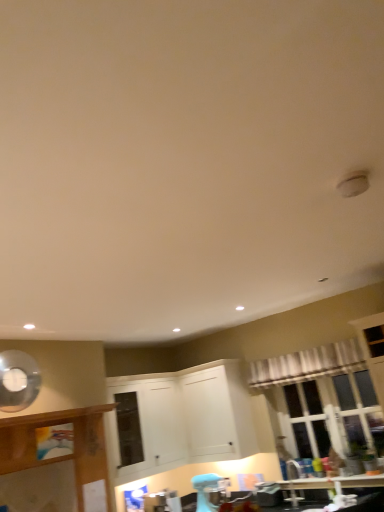
Question: From a real-world perspective, is white matte cabinet at center, arranged as the second cabinetry when viewed from the left, positioned above or below white sheer curtain at upper right?

Choices:
 (A) above
 (B) below

Answer: (B)

Question: Relative to white sheer curtain at upper right, is white matte cabinet at center, arranged as the second cabinetry when viewed from the left, in front or behind?

Choices:
 (A) behind
 (B) front

Answer: (A)

Question: Based on their relative distances, which object is farther from the wooden cabinet at left, the 3th cabinetry when ordered from right to left?

Choices:
 (A) white matte cabinet at center, the 1th cabinetry in the right-to-left sequence
 (B) white sheer curtain at upper right
 (C) white matte cabinet at center, which is the 2th cabinetry from right to left

Answer: (B)

Question: Which object is positioned farthest from the wooden cabinet at left, the 1th cabinetry from the left?

Choices:
 (A) white matte cabinet at center, which is the 2th cabinetry from right to left
 (B) white sheer curtain at upper right
 (C) white matte cabinet at center, the 1th cabinetry in the right-to-left sequence

Answer: (B)